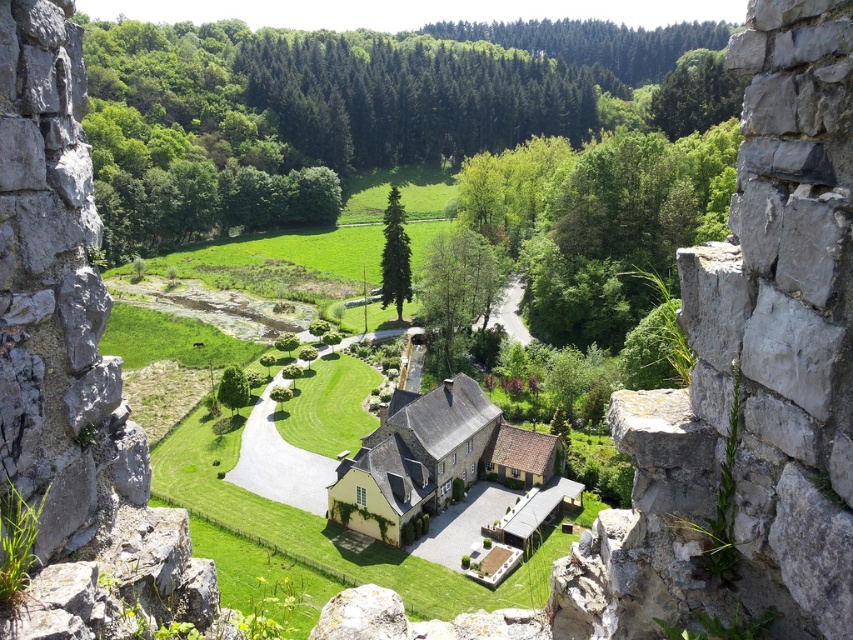
Question: Which object is positioned farthest from the green grass at center?

Choices:
 (A) rough stone wall at left
 (B) yellow matte house at center

Answer: (A)

Question: Which object appears closest to the camera in this image?

Choices:
 (A) green grass at center
 (B) rough stone wall at left

Answer: (B)

Question: Considering the real-world distances, which object is farthest from the yellow matte house at center?

Choices:
 (A) rough stone wall at left
 (B) green grass at center

Answer: (A)

Question: Does rough stone wall at left lie behind green grass at center?

Choices:
 (A) yes
 (B) no

Answer: (B)

Question: Is rough stone wall at left positioned in front of green grass at center?

Choices:
 (A) no
 (B) yes

Answer: (B)

Question: Does rough stone wall at left have a larger size compared to yellow matte house at center?

Choices:
 (A) no
 (B) yes

Answer: (A)